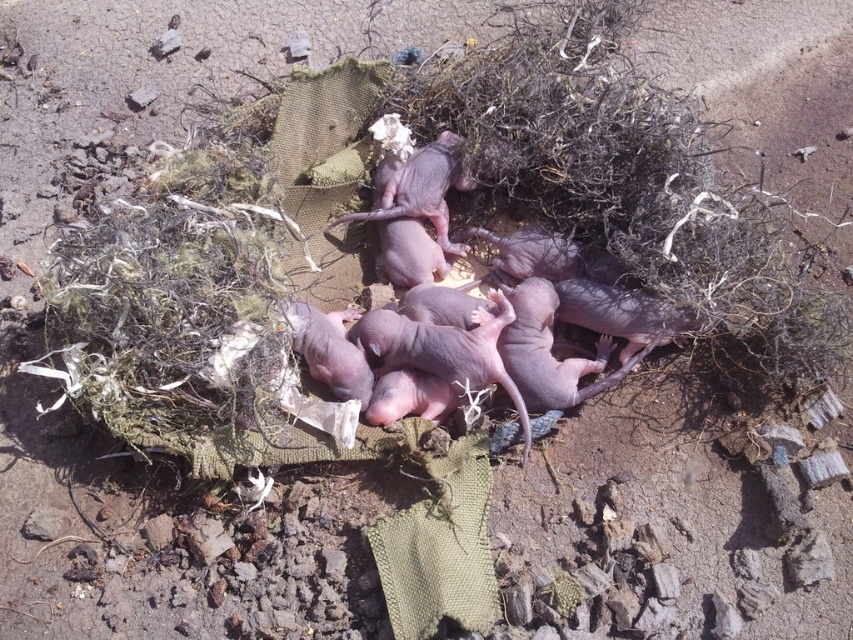
Question: Which point is closer to the camera taking this photo?

Choices:
 (A) (624, 336)
 (B) (416, 173)

Answer: (A)

Question: Where is pink furless mice at center located in relation to pink smooth mouse at center in the image?

Choices:
 (A) right
 (B) left

Answer: (A)

Question: Is pink furless mice at center bigger than pink smooth mouse at center?

Choices:
 (A) no
 (B) yes

Answer: (B)

Question: Does pink furless mice at center appear on the right side of pink smooth mouse at center?

Choices:
 (A) yes
 (B) no

Answer: (A)